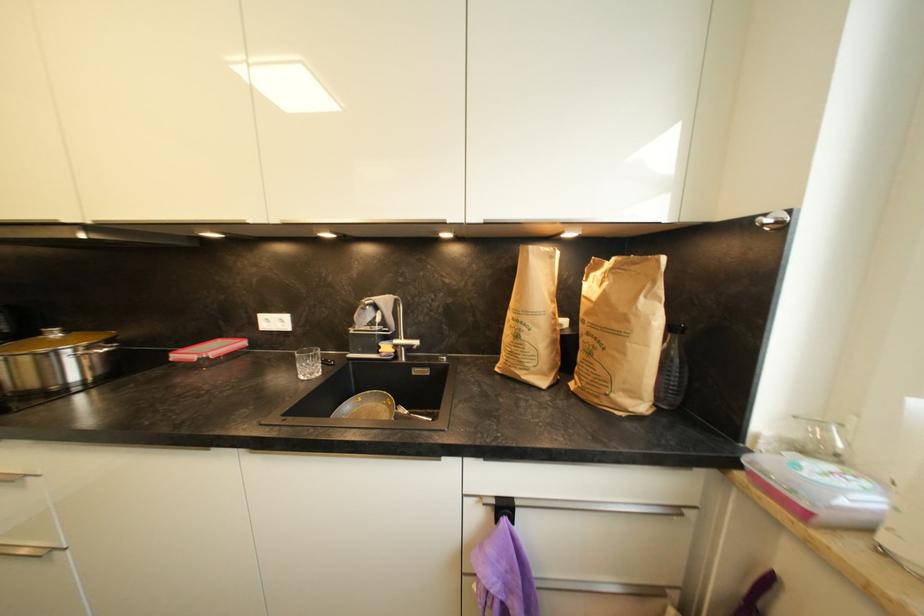
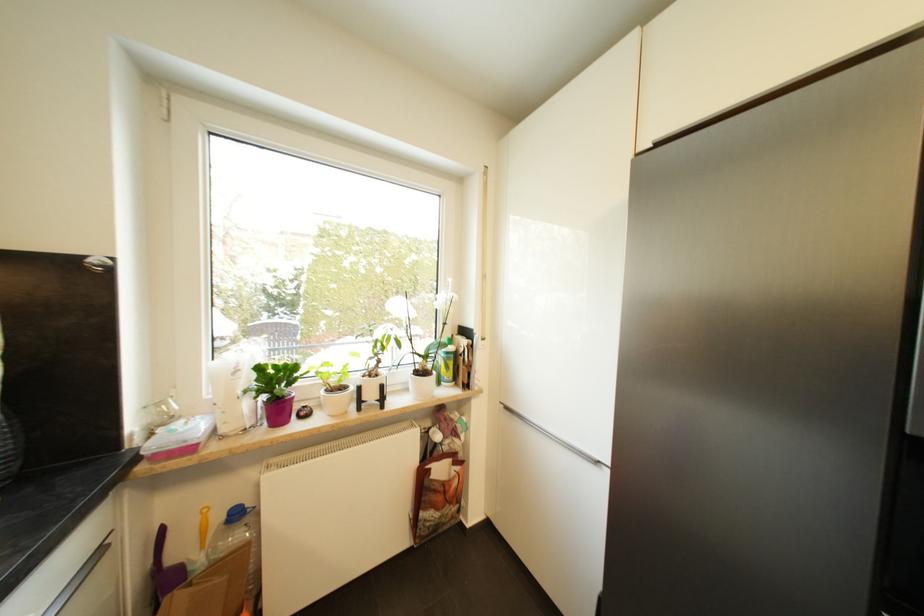
The point at (682, 513) is marked in the first image. Where is the corresponding point in the second image?

(105, 553)